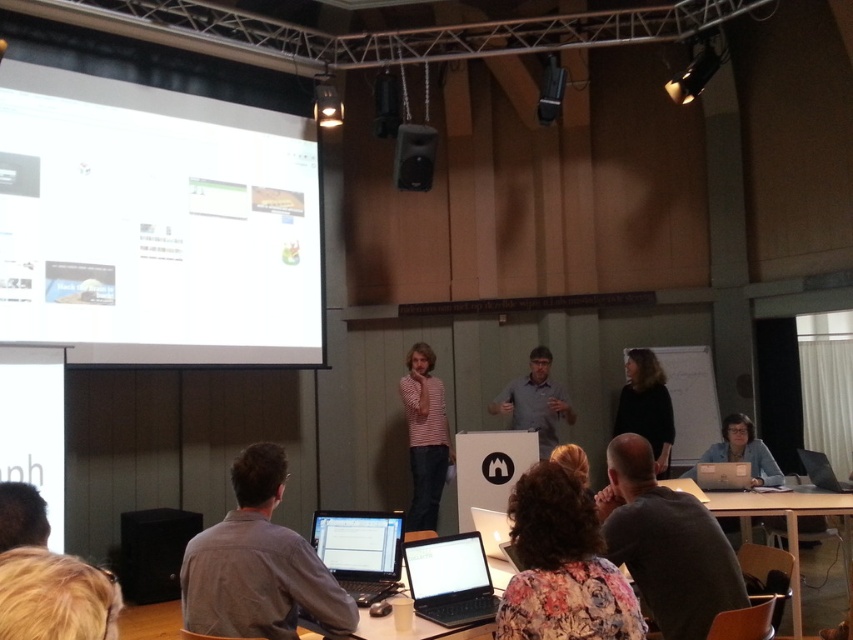
Question: Can you confirm if wooden table at lower right is positioned to the left of white glossy laptop at center?

Choices:
 (A) no
 (B) yes

Answer: (A)

Question: Which object is the farthest from the white matte projection screen at upper left?

Choices:
 (A) matte black laptop at lower right
 (B) dark gray shirt at lower center

Answer: (B)

Question: Which object is closer to the camera taking this photo?

Choices:
 (A) wooden table at lower right
 (B) matte black laptop at center
 (C) white glossy laptop at center

Answer: (C)

Question: Among these points, which one is farthest from the camera?

Choices:
 (A) (408, 157)
 (B) (164, 589)
 (C) (260, 481)
 (D) (675, 557)

Answer: (A)

Question: Can you confirm if dark gray shirt at lower center is positioned to the left of matte black laptop at lower right?

Choices:
 (A) no
 (B) yes

Answer: (B)

Question: Does white matte projection screen at upper left appear on the left side of gray shirt at lower left?

Choices:
 (A) yes
 (B) no

Answer: (A)